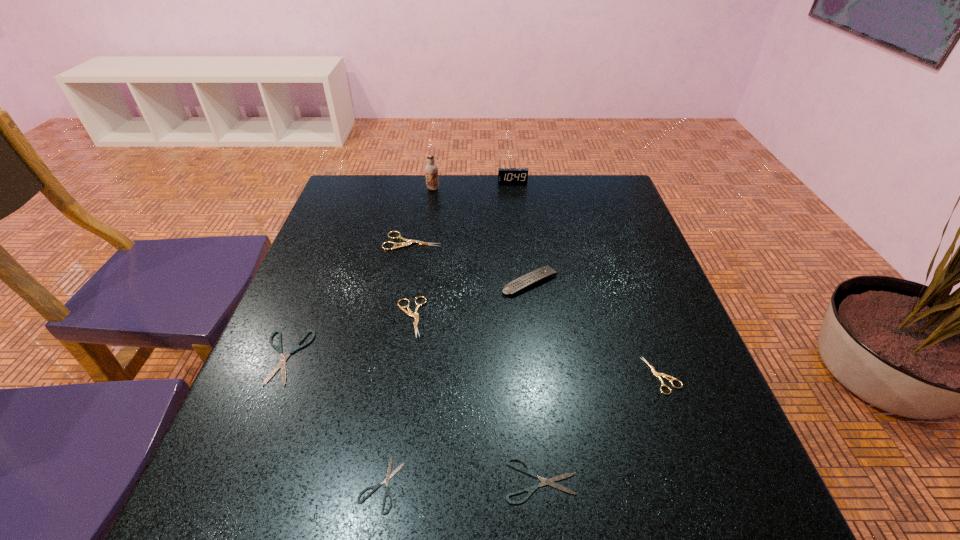
Locate an element on the screen. This screenshot has height=540, width=960. blank region between the leftmost black shears and the tallest object is located at coordinates (359, 273).

Find the location of `free space between the eighth shortest object and the tallest object`. free space between the eighth shortest object and the tallest object is located at coordinates (472, 185).

Image resolution: width=960 pixels, height=540 pixels. Identify the location of vacant space that's between the tallest shears and the second tallest object. (463, 212).

Locate an element on the screen. empty location between the second shears from right to left and the leftmost shears is located at coordinates (413, 418).

Identify the location of vacant space that's between the second tallest shears and the leftmost object. The image size is (960, 540). (348, 337).

I want to click on unoccupied position between the smallest black shears and the remote control, so click(456, 383).

Identify the location of free point between the rightmost black shears and the remote control. The height and width of the screenshot is (540, 960). (536, 381).

Locate which object ranks sixth in proximity to the fourth farthest object. Please provide its 2D coordinates. Your answer should be formatted as a tuple, i.e. [(x, y)], where the tuple contains the x and y coordinates of a point satisfying the conditions above.

[(505, 175)]

Image resolution: width=960 pixels, height=540 pixels. Find the location of `object that stands as the third closest to the eighth shortest object`. object that stands as the third closest to the eighth shortest object is located at coordinates (545, 272).

Find the location of a particular element. shears identified as the closest to the second biggest beige shears is located at coordinates (281, 364).